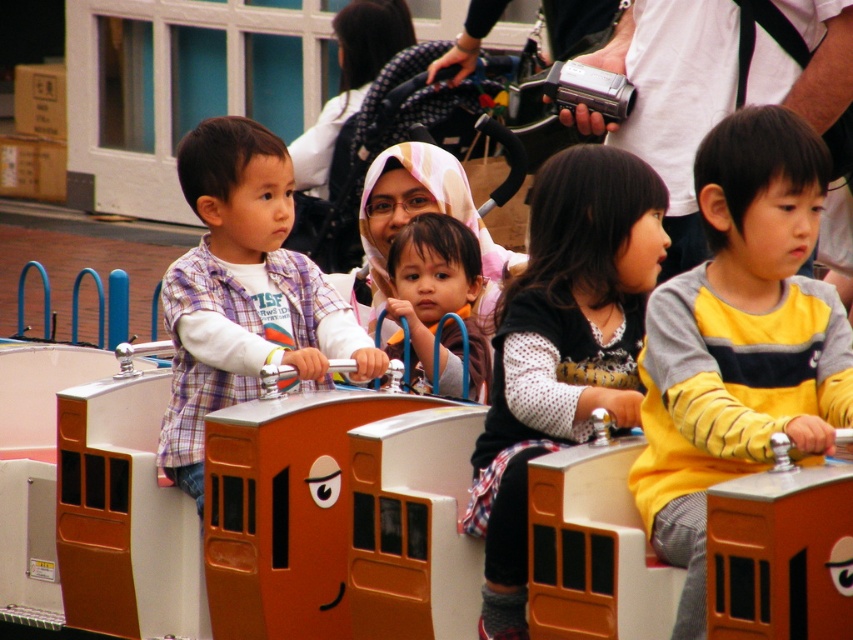
Question: Is yellow striped sweater at center bigger than white dotted sweater at center?

Choices:
 (A) no
 (B) yes

Answer: (B)

Question: Can you confirm if yellow striped sweater at center is positioned to the right of plaid fabric shirt at left?

Choices:
 (A) no
 (B) yes

Answer: (B)

Question: Based on their relative distances, which object is nearer to the yellow striped sweater at center?

Choices:
 (A) matte plastic toy at center
 (B) plaid fabric shirt at left
 (C) white dotted sweater at center

Answer: (C)

Question: Is yellow striped sweater at center closer to the viewer compared to plaid fabric shirt at left?

Choices:
 (A) no
 (B) yes

Answer: (B)

Question: Which point is farther from the camera taking this photo?

Choices:
 (A) (695, 525)
 (B) (619, 339)
 (C) (183, 387)

Answer: (C)

Question: Which object appears farthest from the camera in this image?

Choices:
 (A) plaid fabric shirt at left
 (B) white dotted sweater at center

Answer: (A)